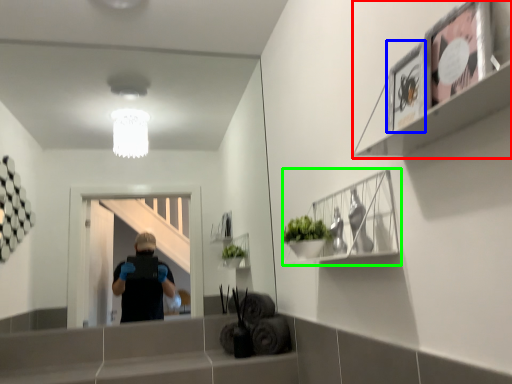
Question: Considering the real-world distances, which object is closest to shelf (highlighted by a red box)? picture frame (highlighted by a blue box) or cabinet (highlighted by a green box).

Choices:
 (A) picture frame
 (B) cabinet

Answer: (A)